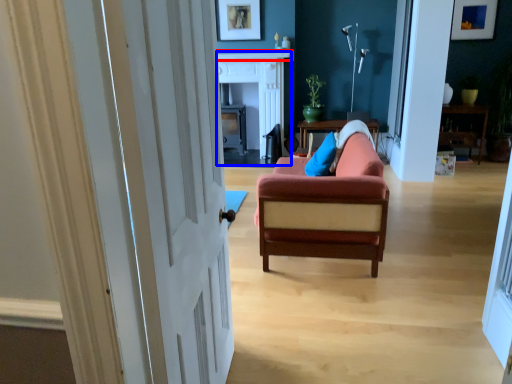
Question: Which object appears closest to the camera in this image, mantle (highlighted by a red box) or fireplace (highlighted by a blue box)?

Choices:
 (A) mantle
 (B) fireplace

Answer: (B)